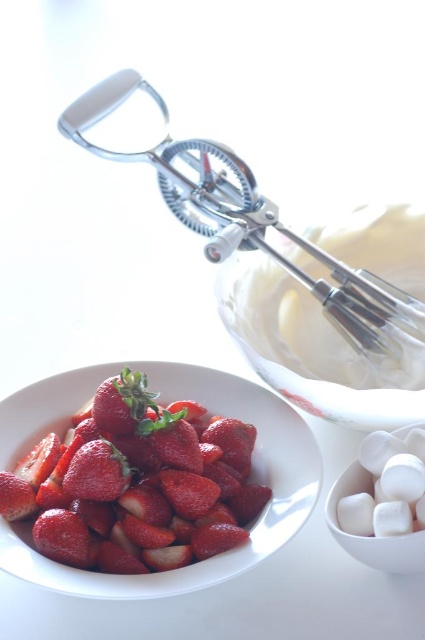
Describe the element at coordinates (255, 477) in the screenshot. I see `smooth matte white bowl at lower left` at that location.

Is smooth matte white bowl at lower left to the left of white matte marshmallows at lower right from the viewer's perspective?

Yes, smooth matte white bowl at lower left is to the left of white matte marshmallows at lower right.

Which is behind, point (51, 570) or point (337, 524)?

Point (337, 524)

Identify the location of smooth matte white bowl at lower left. Image resolution: width=425 pixels, height=640 pixels. (255, 477).

Does smooth matte white bowl at lower left appear under glossy red strawberry at center?

Yes, smooth matte white bowl at lower left is below glossy red strawberry at center.

Who is taller, smooth matte white bowl at lower left or glossy red strawberry at center?

smooth matte white bowl at lower left

Which is behind, point (39, 563) or point (122, 492)?

Positioned behind is point (122, 492).

Identify the location of smooth matte white bowl at lower left. This screenshot has height=640, width=425. (255, 477).

Does clear glass bowl at upper center appear under metallic whisk at upper center?

Yes, clear glass bowl at upper center is below metallic whisk at upper center.

Is point (306, 368) less distant than point (374, 296)?

No, (306, 368) is further to viewer.

You are a GUI agent. You are given a task and a screenshot of the screen. Output one action in this format:
    pyautogui.click(x=<x>, y=<y>)
    Task: Click on the clear glass bowl at upper center
    The height and width of the screenshot is (640, 425).
    Given the screenshot: What is the action you would take?
    pyautogui.click(x=314, y=349)